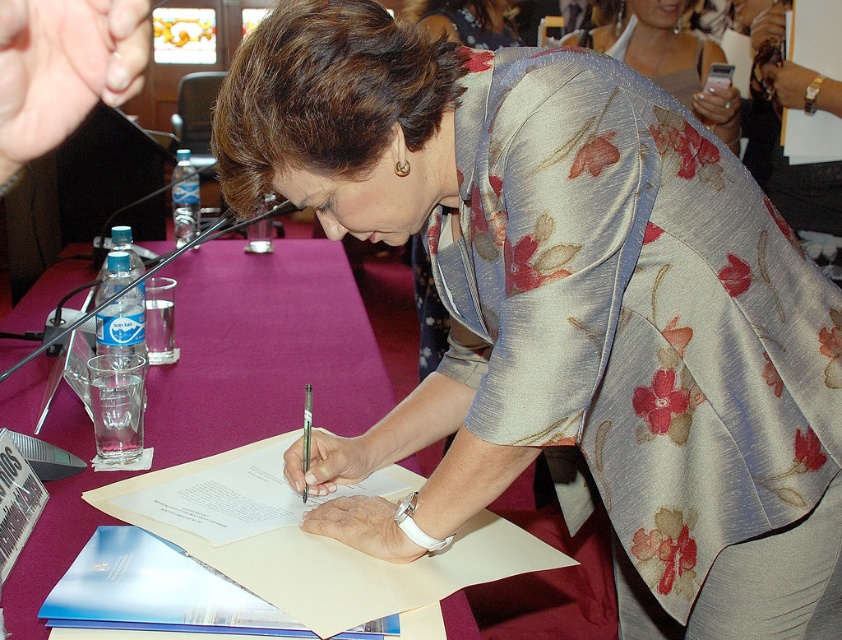
Does purple fabric table at center appear on the right side of white paper at center?

No, purple fabric table at center is not to the right of white paper at center.

The height and width of the screenshot is (640, 842). I want to click on purple fabric table at center, so click(264, 349).

You are a GUI agent. You are given a task and a screenshot of the screen. Output one action in this format:
    pyautogui.click(x=<x>, y=<y>)
    Task: Click on the purple fabric table at center
    Image resolution: width=842 pixels, height=640 pixels.
    Given the screenshot: What is the action you would take?
    pyautogui.click(x=264, y=349)

Is point (763, 280) closer to viewer compared to point (193, 413)?

That is True.

Is floral silk blouse at center below purple fabric table at center?

Indeed, floral silk blouse at center is positioned under purple fabric table at center.

Who is more forward, (289,58) or (237,371)?

Positioned in front is point (289,58).

This screenshot has width=842, height=640. Identify the location of floral silk blouse at center. (565, 310).

Which is behind, point (429, 60) or point (251, 541)?

Positioned behind is point (251, 541).

Between point (401, 97) and point (472, 563), which one is positioned behind?

Point (472, 563)

Identify the location of floral silk blouse at center. The height and width of the screenshot is (640, 842). (565, 310).